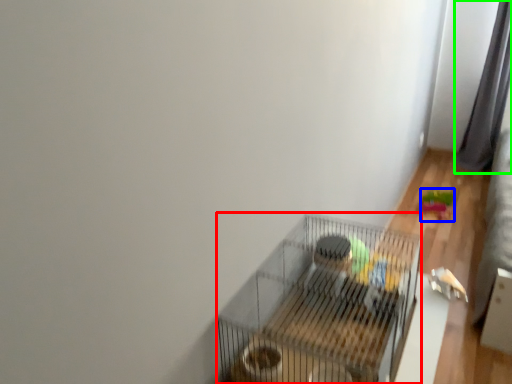
Question: Which object is the farthest from bird cage (highlighted by a red box)? Choose among these: toy (highlighted by a blue box) or curtain (highlighted by a green box).

Choices:
 (A) toy
 (B) curtain

Answer: (B)